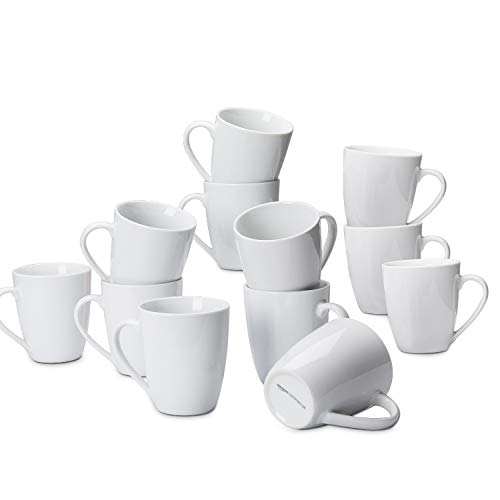
You are a GUI agent. You are given a task and a screenshot of the screen. Output one action in this format:
    pyautogui.click(x=<x>, y=<y>)
    Task: Click on the inside of mug
    The image size is (500, 500).
    Given the screenshot: What is the action you would take?
    pyautogui.click(x=157, y=214), pyautogui.click(x=251, y=121), pyautogui.click(x=269, y=227), pyautogui.click(x=182, y=309)